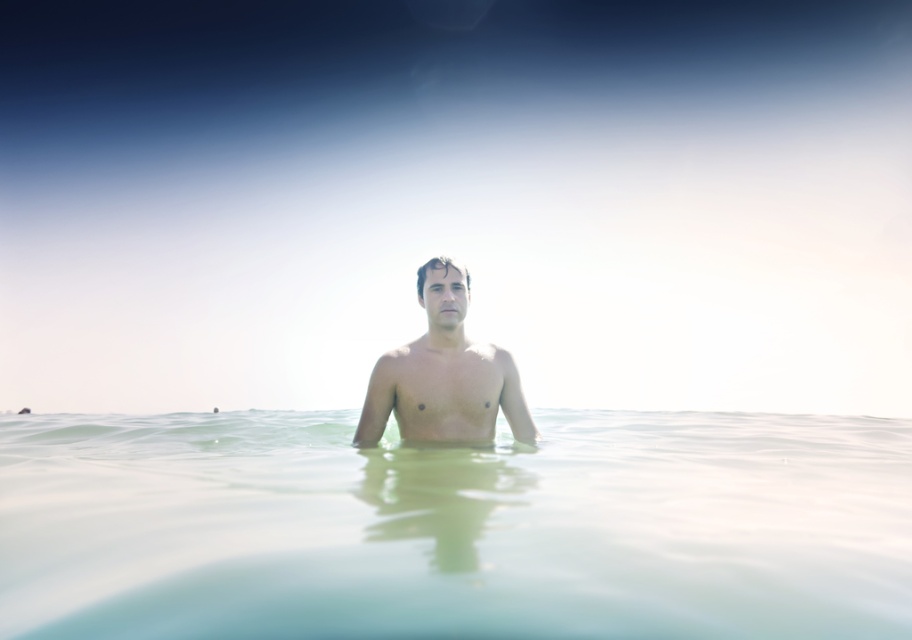
Who is more distant from viewer, (644, 515) or (431, 339)?

The point (431, 339) is behind.

How distant is clear water at center from smooth skin man at center?

clear water at center and smooth skin man at center are 26.92 inches apart from each other.

Describe the element at coordinates (456, 528) in the screenshot. The image size is (912, 640). I see `clear water at center` at that location.

The height and width of the screenshot is (640, 912). Find the location of `clear water at center`. clear water at center is located at coordinates (456, 528).